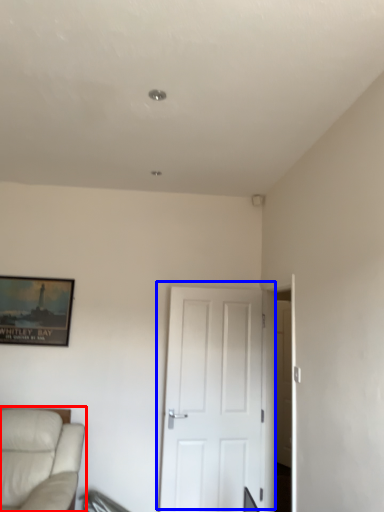
Question: Which of the following is the closest to the observer, studio couch (highlighted by a red box) or door (highlighted by a blue box)?

Choices:
 (A) studio couch
 (B) door

Answer: (A)